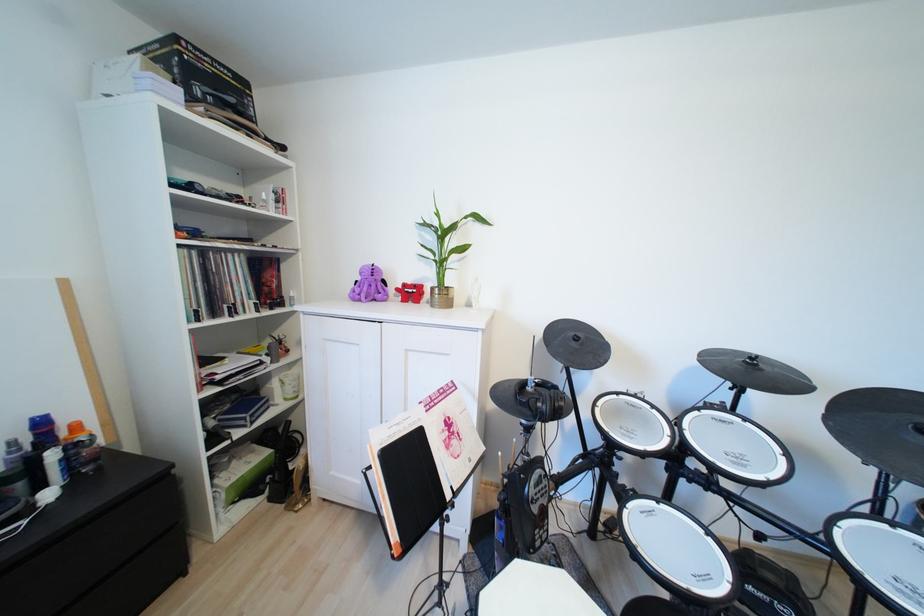
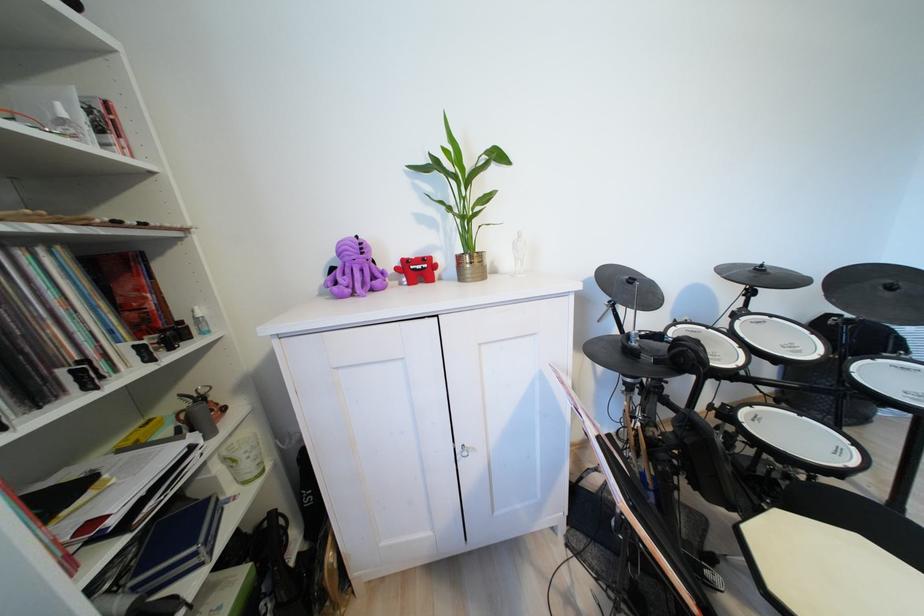
In the second image, find the point that corresponds to point 379,288 in the first image.

(360, 274)